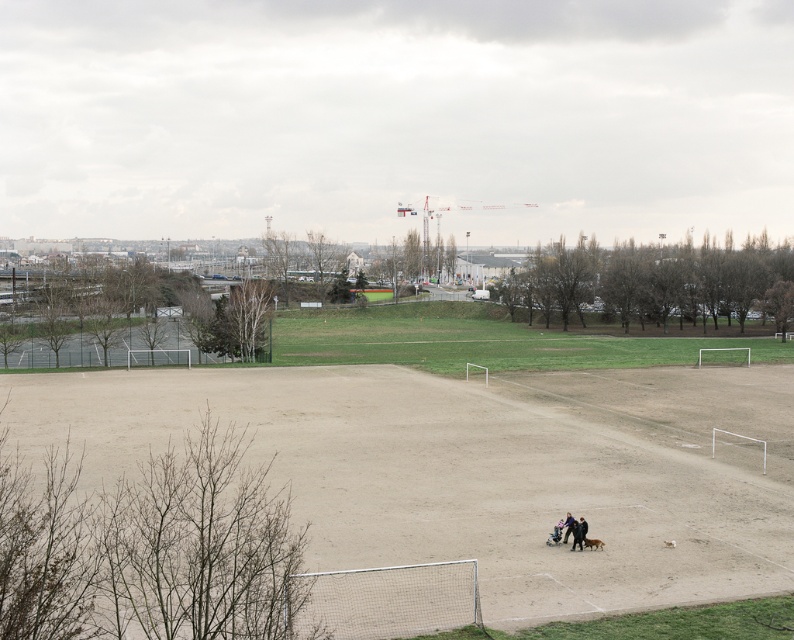
You are a photographer setting up a shot of the matte black couple at lower right and the dark blue jeans at center. Which object should you focus on first if you want to capture both in the same frame without adjusting your camera angle?

The matte black couple at lower right is not as tall as the dark blue jeans at center, so you should focus on the dark blue jeans at center first to ensure both fit in the frame.

What is the 2D coordinate of the brown sandy dirt field at center?

The brown sandy dirt field at center is located at the 2D coordinate point of (478, 468).